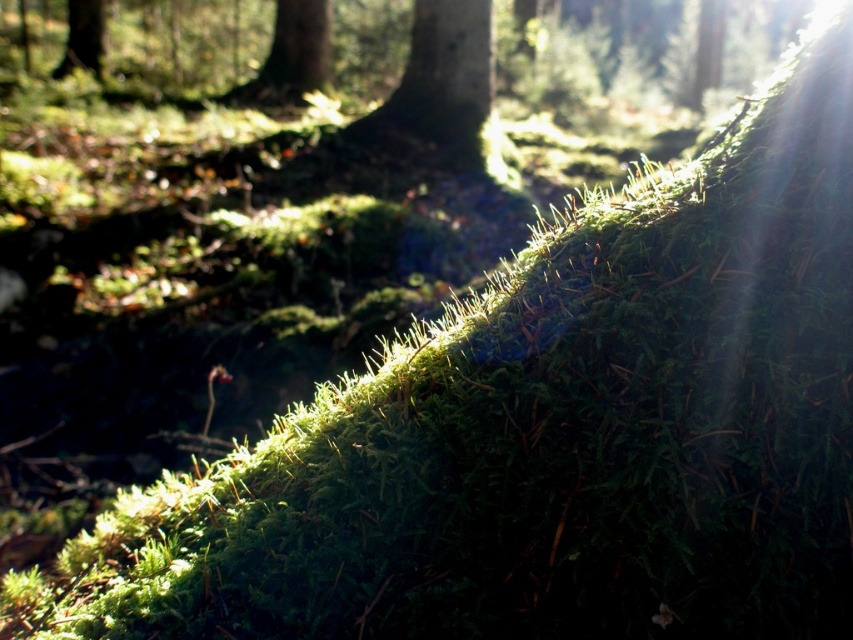
Based on the photo, is green mossy tree trunk at upper center closer to the viewer compared to green mossy tree at upper left?

Yes, it is.

Can you confirm if green mossy tree trunk at upper center is wider than green mossy tree at upper left?

Correct, the width of green mossy tree trunk at upper center exceeds that of green mossy tree at upper left.

Is point (322, 12) farther from camera compared to point (54, 72)?

No, it is in front of (54, 72).

What are the coordinates of `green mossy tree trunk at upper center` in the screenshot? It's located at (289, 58).

Is green mossy tree trunk at center to the right of green mossy tree at upper left from the viewer's perspective?

Correct, you'll find green mossy tree trunk at center to the right of green mossy tree at upper left.

Is green mossy tree trunk at center behind green mossy tree at upper left?

No, green mossy tree trunk at center is in front of green mossy tree at upper left.

Which is behind, point (421, 35) or point (99, 13)?

The point (99, 13) is behind.

This screenshot has height=640, width=853. What are the coordinates of `green mossy tree trunk at center` in the screenshot? It's located at (438, 88).

Is green mossy tree trunk at center above green mossy tree trunk at upper center?

No, green mossy tree trunk at center is not above green mossy tree trunk at upper center.

Between green mossy tree trunk at center and green mossy tree trunk at upper center, which one has more height?

With more height is green mossy tree trunk at upper center.

Which is behind, point (439, 61) or point (311, 13)?

The point (311, 13) is more distant.

Find the location of a particular element. The width and height of the screenshot is (853, 640). green mossy tree trunk at center is located at coordinates coord(438,88).